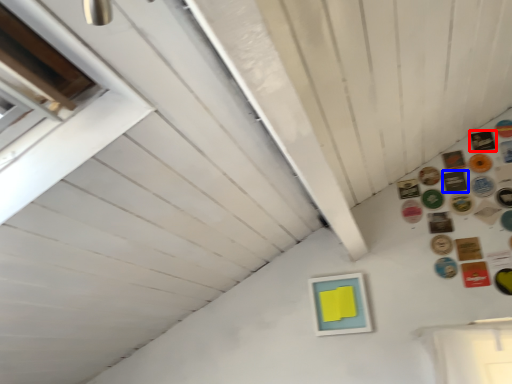
Question: Among these objects, which one is nearest to the camera, button (highlighted by a red box) or button (highlighted by a blue box)?

Choices:
 (A) button
 (B) button

Answer: (B)